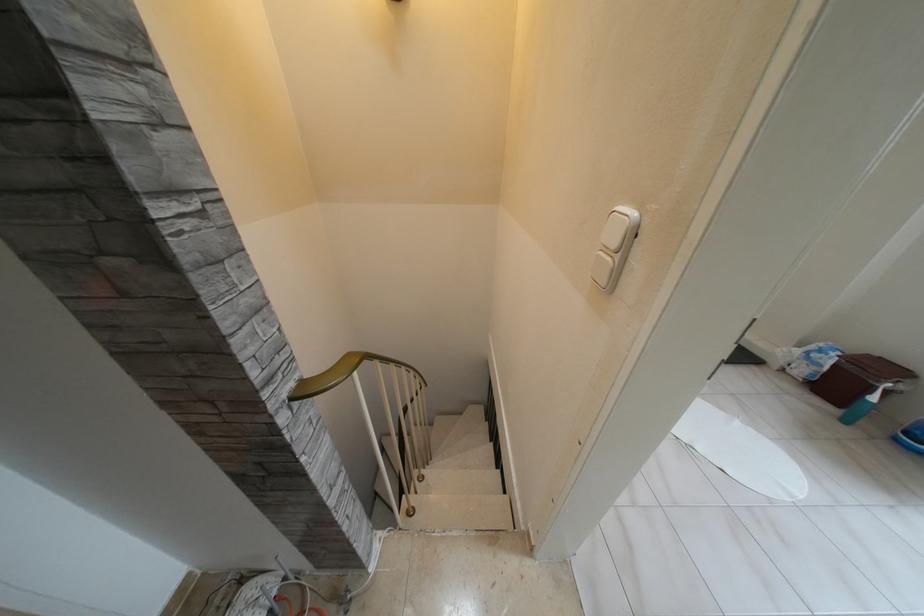
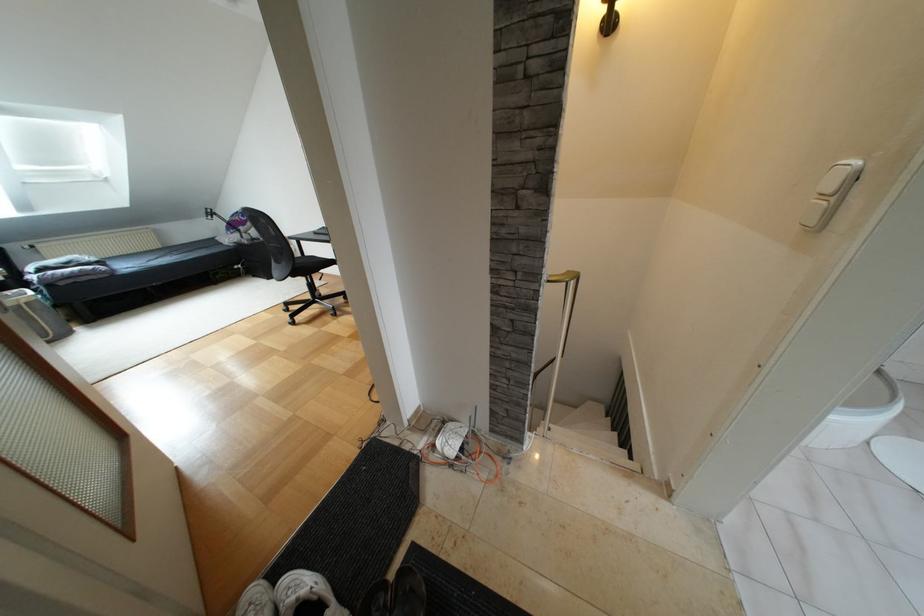
In a continuous first-person perspective shot, in which direction is the camera moving?

The movement direction of the cameraman is left, backward.